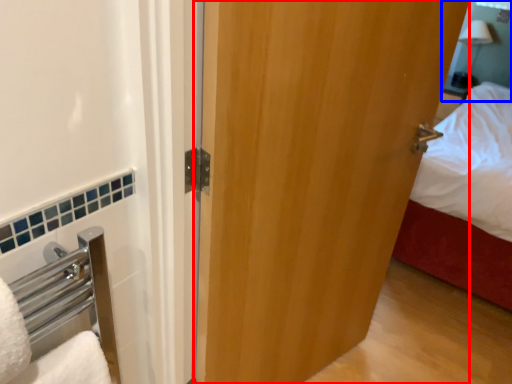
Question: Among these objects, which one is farthest to the camera, door (highlighted by a red box) or mirror (highlighted by a blue box)?

Choices:
 (A) door
 (B) mirror

Answer: (B)